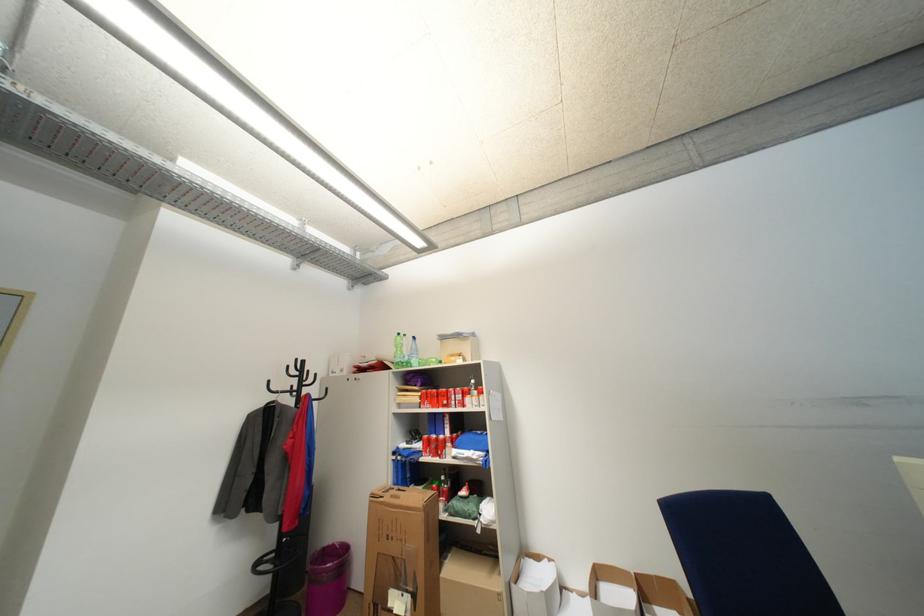
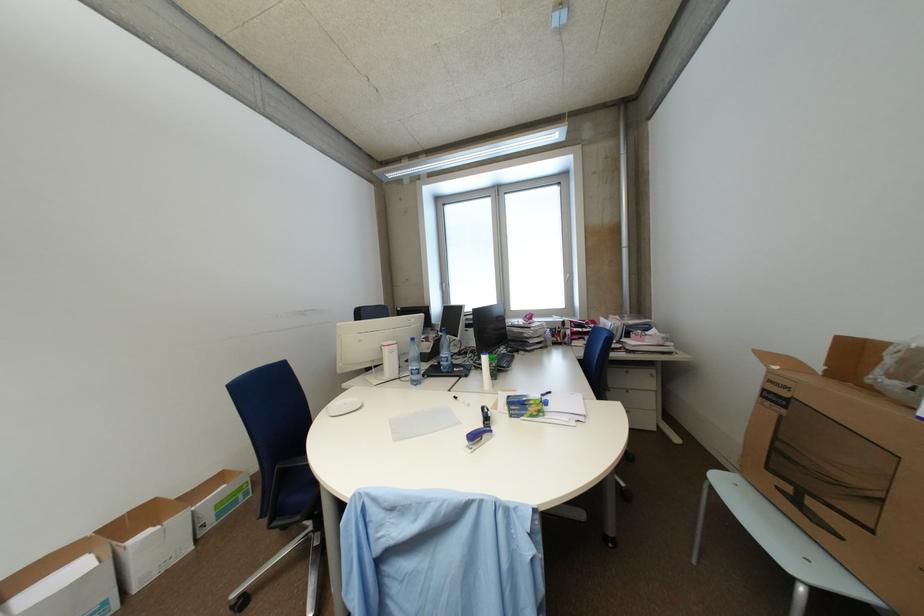
Question: The images are taken continuously from a first-person perspective. In which direction is your viewpoint rotating?

Choices:
 (A) Left
 (B) Right
 (C) Up
 (D) Down

Answer: (B)